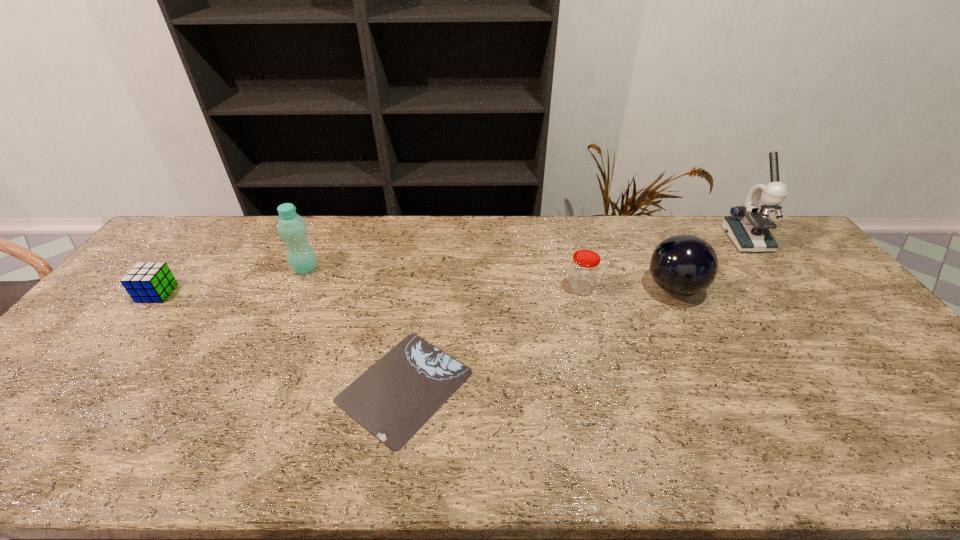
Find the location of `object present at the far edge`. object present at the far edge is located at coordinates (748, 226).

The image size is (960, 540). Identify the location of object that is at the near edge. (396, 396).

Find the location of a particular element. This screenshot has width=960, height=540. object located at the left edge is located at coordinates (151, 282).

Where is `object located in the right edge section of the desktop`? Image resolution: width=960 pixels, height=540 pixels. object located in the right edge section of the desktop is located at coordinates (748, 226).

I want to click on object located in the far right corner section of the desktop, so click(748, 226).

The height and width of the screenshot is (540, 960). Find the location of `free spot at the far edge of the desktop`. free spot at the far edge of the desktop is located at coordinates (524, 226).

Where is `vacant position at the near edge of the desktop`? The height and width of the screenshot is (540, 960). vacant position at the near edge of the desktop is located at coordinates (86, 433).

Locate an element on the screen. vacant space at the left edge of the desktop is located at coordinates (63, 401).

Image resolution: width=960 pixels, height=540 pixels. Identify the location of empty space that is in between the third object from left to right and the fourth tallest object. (492, 337).

Locate an element on the screen. This screenshot has height=540, width=960. vacant area that lies between the second tallest object and the bowling ball is located at coordinates (490, 278).